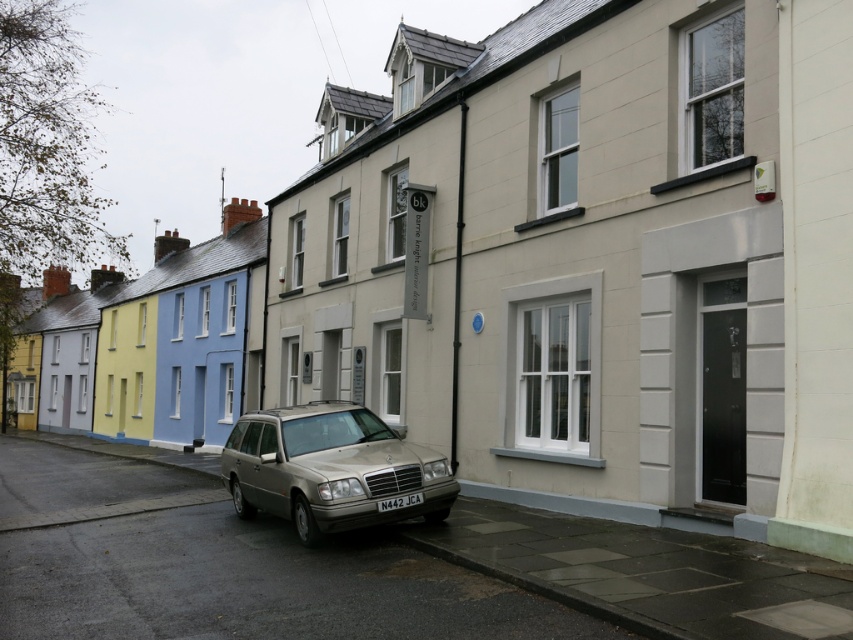
Question: Which point is closer to the camera taking this photo?

Choices:
 (A) (410, 493)
 (B) (305, 426)

Answer: (A)

Question: Is metallic silver station wagon at center smaller than white plastic license plate at center?

Choices:
 (A) no
 (B) yes

Answer: (A)

Question: Is metallic silver station wagon at center above white plastic license plate at center?

Choices:
 (A) no
 (B) yes

Answer: (B)

Question: Is metallic silver station wagon at center wider than white plastic license plate at center?

Choices:
 (A) yes
 (B) no

Answer: (A)